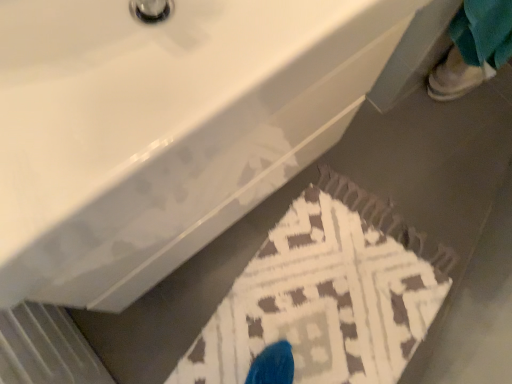
Locate an element on the screen. The image size is (512, 384). vacant space underneath brown textured rug at lower center (from a real-world perspective) is located at coordinates (333, 288).